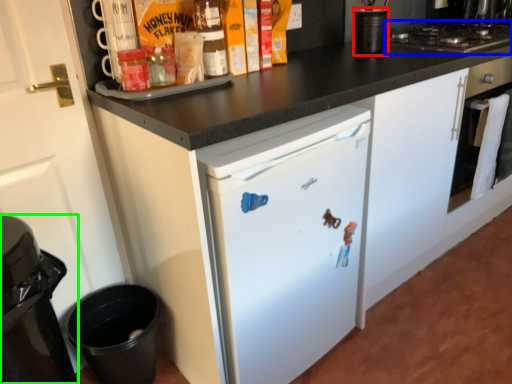
Question: Which object is positioned closest to appliance (highlighted by a red box)? Select from gas stove (highlighted by a blue box) and home appliance (highlighted by a green box).

Choices:
 (A) gas stove
 (B) home appliance

Answer: (A)